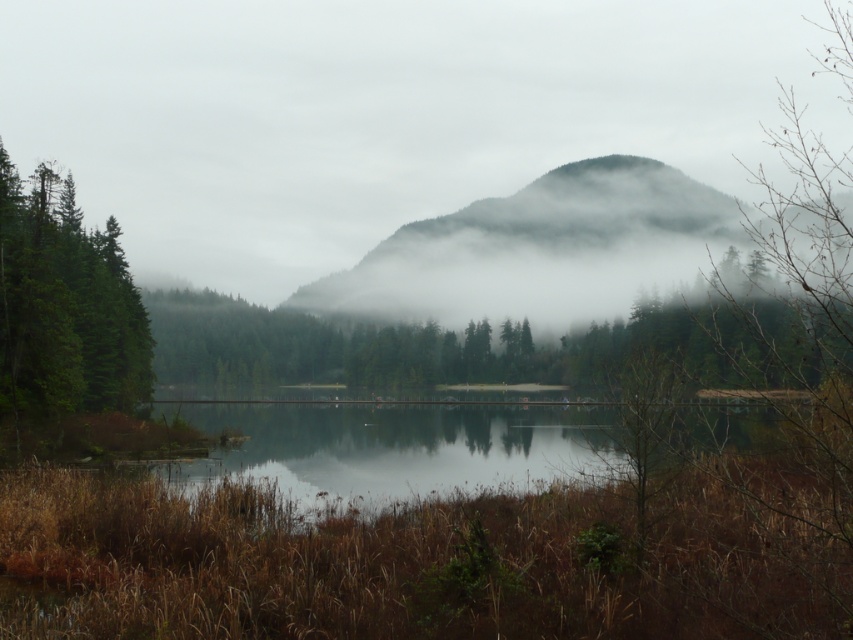
Question: Can you confirm if foggy misty mountain at center is wider than foggy forested mountain at center?

Choices:
 (A) no
 (B) yes

Answer: (B)

Question: Observing the image, what is the correct spatial positioning of foggy misty mountain at center in reference to green matte tree at left?

Choices:
 (A) above
 (B) below

Answer: (A)

Question: Among these points, which one is nearest to the camera?

Choices:
 (A) click(577, 168)
 (B) click(479, 90)

Answer: (A)

Question: Which of these objects is positioned farthest from the green matte tree at left?

Choices:
 (A) foggy forested mountain at center
 (B) foggy misty mountain at center

Answer: (B)

Question: Can you confirm if foggy misty mountain at center is positioned below green matte tree at left?

Choices:
 (A) no
 (B) yes

Answer: (A)

Question: Based on their relative distances, which object is nearer to the green matte tree at left?

Choices:
 (A) foggy forested mountain at center
 (B) foggy misty mountain at center

Answer: (A)